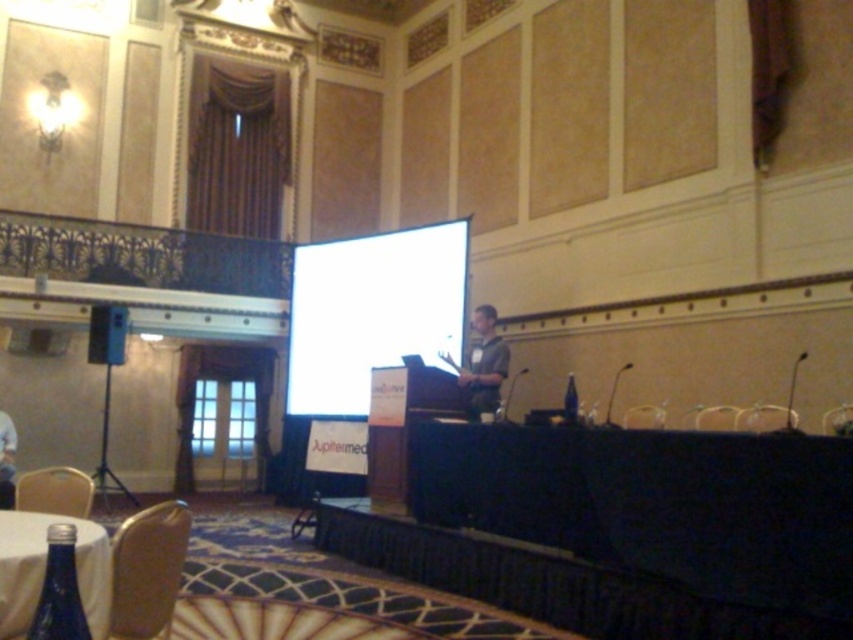
Which is more to the right, light brown plastic chair at lower left or metallic silver chair at lower right?

metallic silver chair at lower right is more to the right.

Does light brown plastic chair at lower left have a larger size compared to metallic silver chair at lower right?

No.

This screenshot has width=853, height=640. What are the coordinates of `light brown plastic chair at lower left` in the screenshot? It's located at [x=55, y=492].

Based on the photo, can you confirm if white glossy projection screen at center is bigger than blue glass bottle at center?

Indeed, white glossy projection screen at center has a larger size compared to blue glass bottle at center.

Is point (318, 362) farther from viewer compared to point (566, 394)?

That is False.

Image resolution: width=853 pixels, height=640 pixels. What do you see at coordinates (372, 310) in the screenshot?
I see `white glossy projection screen at center` at bounding box center [372, 310].

Identify the location of white glossy projection screen at center. This screenshot has width=853, height=640. (372, 310).

At what (x,y) coordinates should I click in order to perform the action: click on metallic gold chair at lower left. Please return your answer as a coordinate pair (x, y). The height and width of the screenshot is (640, 853). Looking at the image, I should click on (148, 570).

Who is lower down, metallic gold chair at lower left or green fabric shirt at center?

metallic gold chair at lower left

The image size is (853, 640). What do you see at coordinates (148, 570) in the screenshot?
I see `metallic gold chair at lower left` at bounding box center [148, 570].

Find the location of `metallic gold chair at lower left`. metallic gold chair at lower left is located at coordinates (148, 570).